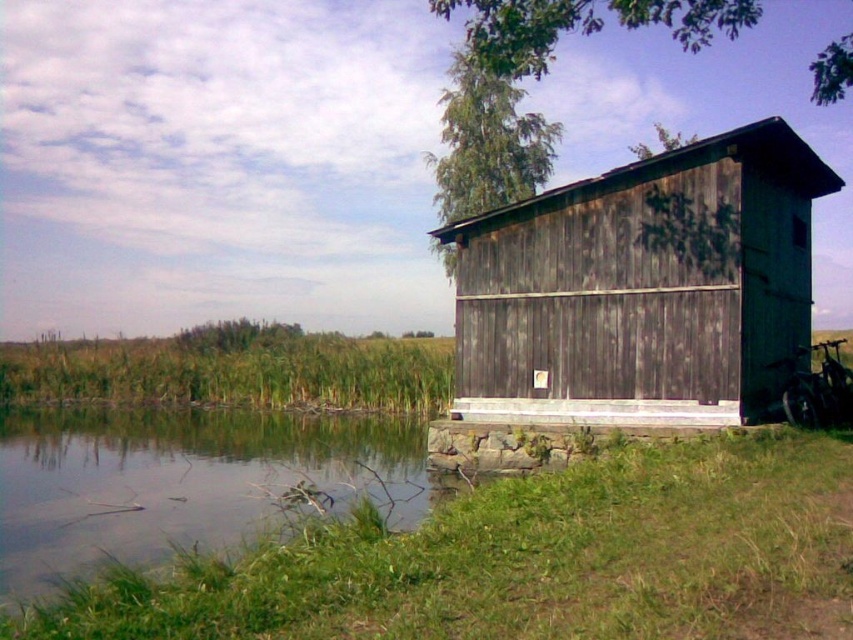
Can you confirm if weathered wood hut at right is smaller than clear water at lower left?

Indeed, weathered wood hut at right has a smaller size compared to clear water at lower left.

Who is positioned more to the left, weathered wood hut at right or clear water at lower left?

From the viewer's perspective, clear water at lower left appears more on the left side.

Looking at this image, measure the distance between point (721, 257) and camera.

The distance of point (721, 257) from camera is 13.24 meters.

Find the location of `weathered wood hut at right`. weathered wood hut at right is located at coordinates (642, 288).